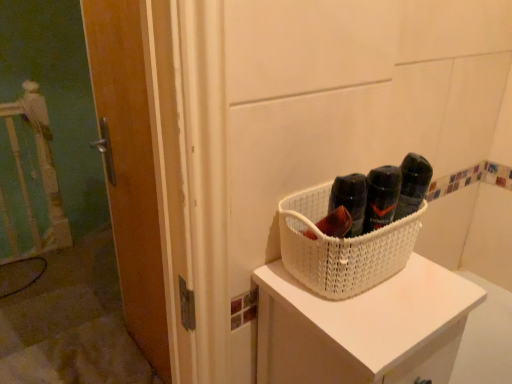
Find the location of `free spot in front of white woven basket at center`. free spot in front of white woven basket at center is located at coordinates (379, 320).